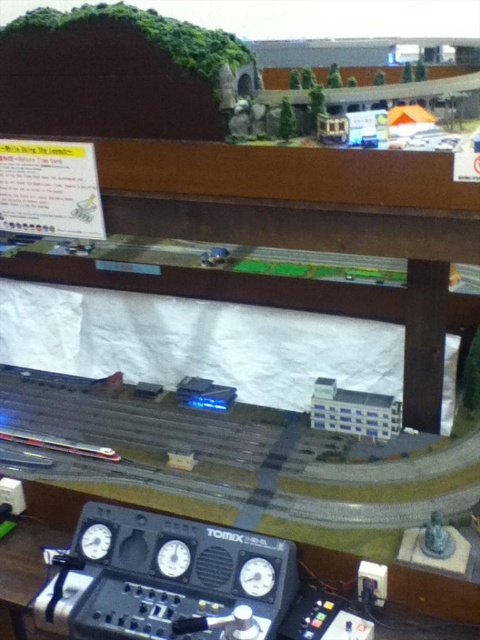
Is white plastic building at center shorter than matte black gauge at bottom center?

In fact, white plastic building at center may be taller than matte black gauge at bottom center.

The image size is (480, 640). What do you see at coordinates (354, 412) in the screenshot?
I see `white plastic building at center` at bounding box center [354, 412].

Where is `white plastic building at center`? The image size is (480, 640). white plastic building at center is located at coordinates (354, 412).

Who is higher up, matte black gauge at bottom center or matte black gauge at lower left?

Positioned higher is matte black gauge at lower left.

Between point (264, 561) and point (83, 545), which one is positioned in front?

Point (264, 561) is more forward.

Identify the location of matte black gauge at bottom center. This screenshot has height=640, width=480. 256,577.

Can you confirm if matte black gauge at bottom center is wider than matte black gauge at center?

Correct, the width of matte black gauge at bottom center exceeds that of matte black gauge at center.

Does matte black gauge at bottom center come in front of matte black gauge at center?

→ Yes, matte black gauge at bottom center is in front of matte black gauge at center.

Identify the location of matte black gauge at bottom center. Image resolution: width=480 pixels, height=640 pixels. (256, 577).